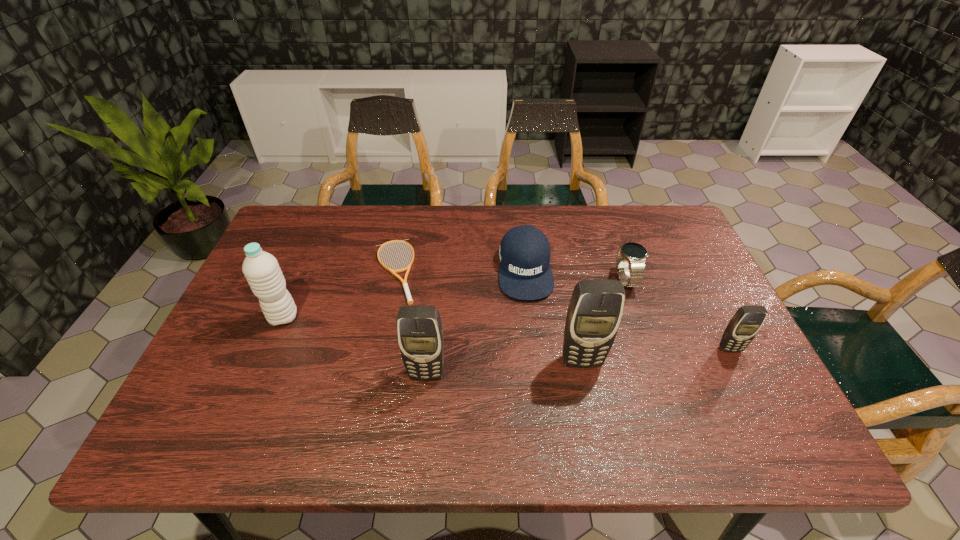
Observe the arrangement of all cellular telephones in the image. To keep them evenly spaced, where would you place another cellular telephone on the left? Please locate a free space. Please provide its 2D coordinates. Your answer should be formatted as a tuple, i.e. [(x, y)], where the tuple contains the x and y coordinates of a point satisfying the conditions above.

[(262, 387)]